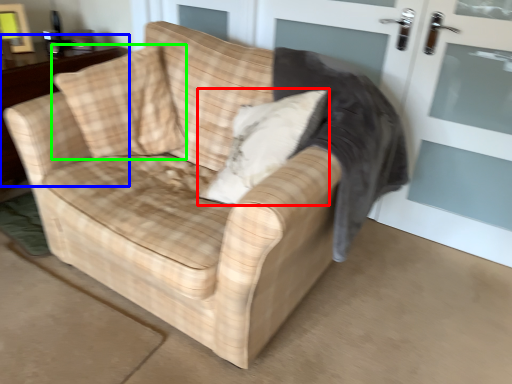
Question: Based on their relative distances, which object is farther from throw pillow (highlighted by a red box)? Choose from table (highlighted by a blue box) and throw pillow (highlighted by a green box).

Choices:
 (A) table
 (B) throw pillow

Answer: (A)